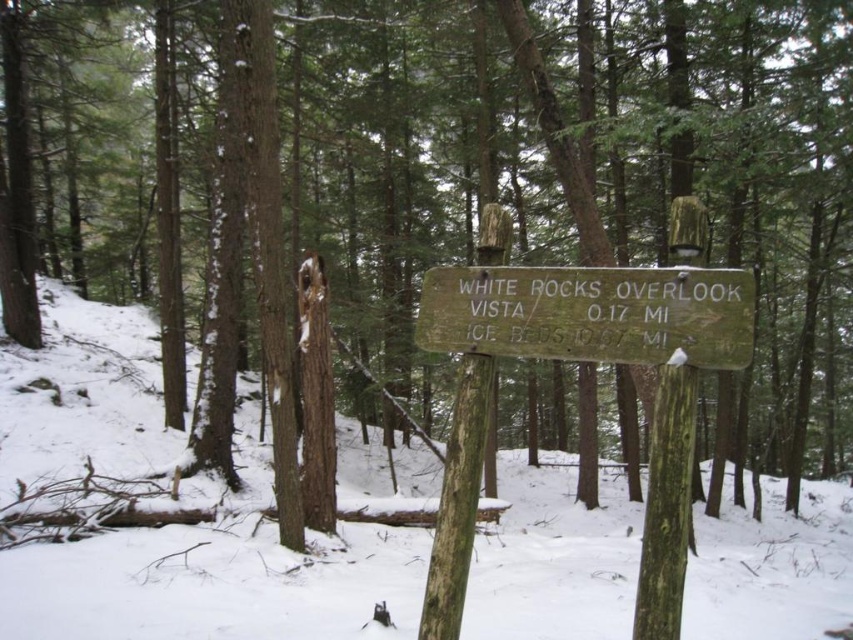
Question: Can you confirm if white matte snow at center is thinner than weathered wood sign at center?

Choices:
 (A) yes
 (B) no

Answer: (B)

Question: Is white matte snow at center bigger than weathered wood sign at center?

Choices:
 (A) no
 (B) yes

Answer: (B)

Question: Does white matte snow at center appear on the right side of weathered wood sign at center?

Choices:
 (A) yes
 (B) no

Answer: (A)

Question: Which point appears closest to the camera in this image?

Choices:
 (A) (732, 310)
 (B) (238, 620)

Answer: (A)

Question: Which of the following is the farthest from the observer?

Choices:
 (A) (241, 390)
 (B) (515, 317)

Answer: (A)